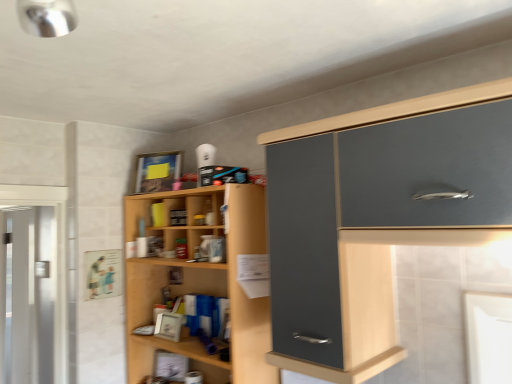
Question: Is clear glass screen door at left wider or thinner than matte gray cabinet at upper right?

Choices:
 (A) thin
 (B) wide

Answer: (A)

Question: From a real-world perspective, is clear glass screen door at left physically located above or below matte gray cabinet at upper right?

Choices:
 (A) above
 (B) below

Answer: (B)

Question: Which of these objects is positioned farthest from the matte gray cabinet at upper right?

Choices:
 (A) wooden shelves at center
 (B) clear glass screen door at left

Answer: (B)

Question: Which is farther from the wooden shelves at center?

Choices:
 (A) matte gray cabinet at upper right
 (B) clear glass screen door at left

Answer: (B)